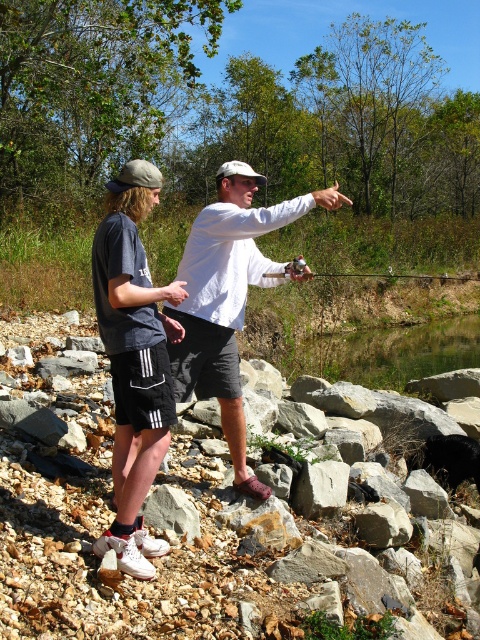
Question: Does white matte shirt at center have a greater width compared to metallic silver fishing rod at center?

Choices:
 (A) no
 (B) yes

Answer: (A)

Question: Can you confirm if white matte shorts at center is positioned to the left of metallic silver fishing rod at center?

Choices:
 (A) yes
 (B) no

Answer: (A)

Question: Which of the following is the closest to the observer?

Choices:
 (A) metallic silver fishing rod at center
 (B) white matte shorts at center
 (C) white matte shirt at center

Answer: (B)

Question: Which object appears closest to the camera in this image?

Choices:
 (A) white matte shorts at center
 (B) metallic silver fishing rod at center

Answer: (A)

Question: Which object is farther from the camera taking this photo?

Choices:
 (A) white matte shirt at center
 (B) white matte shorts at center
 (C) metallic silver fishing rod at center

Answer: (C)

Question: From the image, what is the correct spatial relationship of white matte shorts at center in relation to white matte shirt at center?

Choices:
 (A) above
 (B) below

Answer: (B)